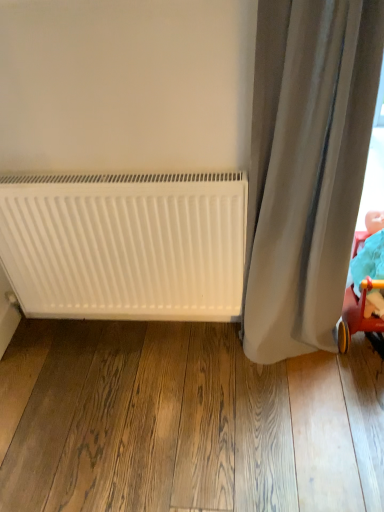
Question: Does gray fabric curtain at right have a greater height compared to white matte radiator at lower left?

Choices:
 (A) yes
 (B) no

Answer: (A)

Question: Considering the relative sizes of gray fabric curtain at right and white matte radiator at lower left in the image provided, is gray fabric curtain at right wider than white matte radiator at lower left?

Choices:
 (A) no
 (B) yes

Answer: (B)

Question: Considering the relative sizes of gray fabric curtain at right and white matte radiator at lower left in the image provided, is gray fabric curtain at right bigger than white matte radiator at lower left?

Choices:
 (A) no
 (B) yes

Answer: (B)

Question: Is gray fabric curtain at right not near white matte radiator at lower left?

Choices:
 (A) no
 (B) yes

Answer: (A)

Question: Does gray fabric curtain at right have a smaller size compared to white matte radiator at lower left?

Choices:
 (A) yes
 (B) no

Answer: (B)

Question: Is matte red plastic baby carriage at lower right taller or shorter than white matte radiator at lower left?

Choices:
 (A) short
 (B) tall

Answer: (A)

Question: In terms of width, does matte red plastic baby carriage at lower right look wider or thinner when compared to white matte radiator at lower left?

Choices:
 (A) thin
 (B) wide

Answer: (B)

Question: Is matte red plastic baby carriage at lower right inside or outside of white matte radiator at lower left?

Choices:
 (A) outside
 (B) inside

Answer: (A)

Question: Considering the positions of matte red plastic baby carriage at lower right and white matte radiator at lower left in the image, is matte red plastic baby carriage at lower right bigger or smaller than white matte radiator at lower left?

Choices:
 (A) big
 (B) small

Answer: (B)

Question: From the image's perspective, is matte red plastic baby carriage at lower right above or below gray fabric curtain at right?

Choices:
 (A) above
 (B) below

Answer: (B)

Question: In the image, is matte red plastic baby carriage at lower right positioned in front of or behind gray fabric curtain at right?

Choices:
 (A) front
 (B) behind

Answer: (B)

Question: From a real-world perspective, relative to gray fabric curtain at right, is matte red plastic baby carriage at lower right vertically above or below?

Choices:
 (A) below
 (B) above

Answer: (A)

Question: Is point (359, 316) closer or farther from the camera than point (296, 133)?

Choices:
 (A) closer
 (B) farther

Answer: (B)

Question: Considering their positions, is gray fabric curtain at right located in front of or behind white matte radiator at lower left?

Choices:
 (A) behind
 (B) front

Answer: (B)

Question: From a real-world perspective, relative to white matte radiator at lower left, is gray fabric curtain at right vertically above or below?

Choices:
 (A) below
 (B) above

Answer: (B)